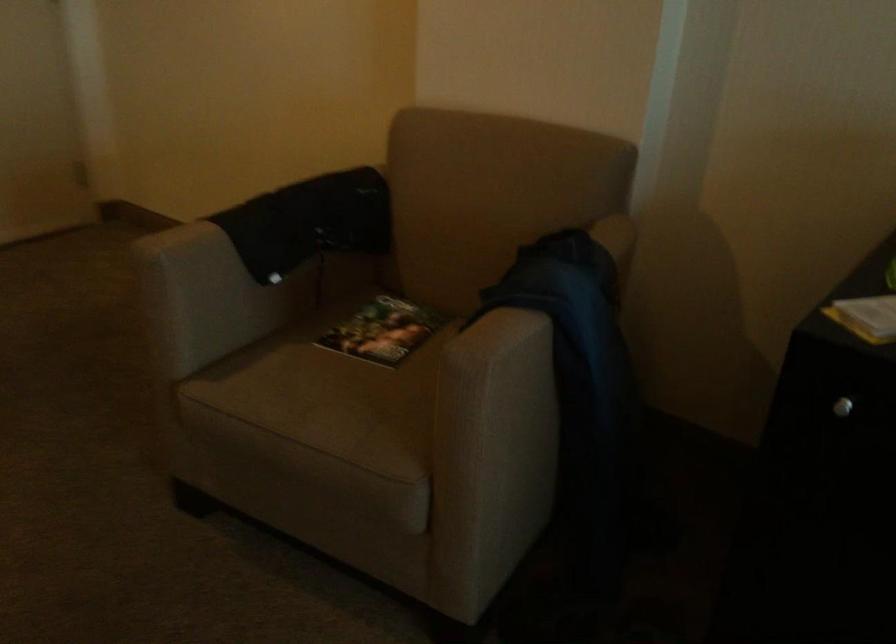
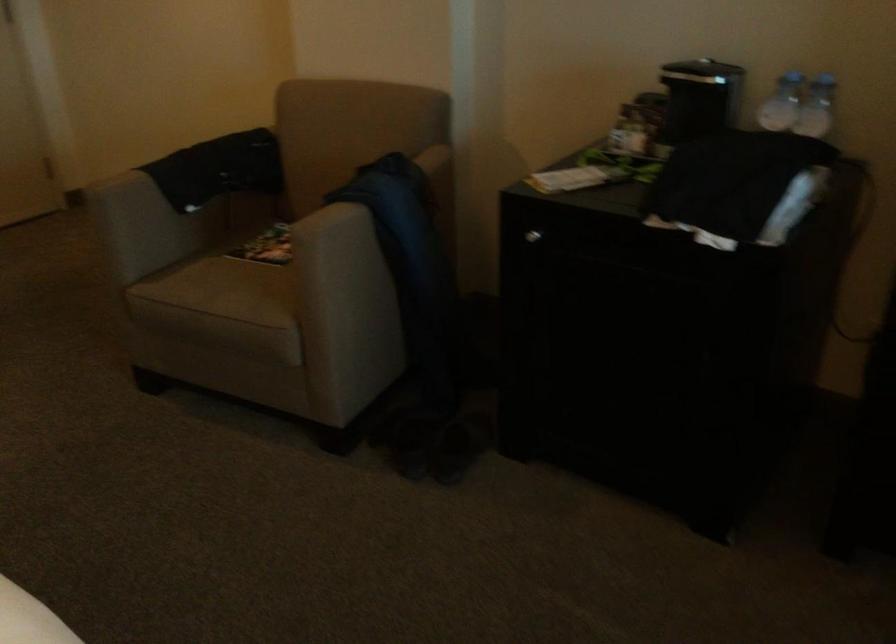
Question: How did the camera likely rotate?

Choices:
 (A) Left
 (B) Right
 (C) Up
 (D) Down

Answer: (D)